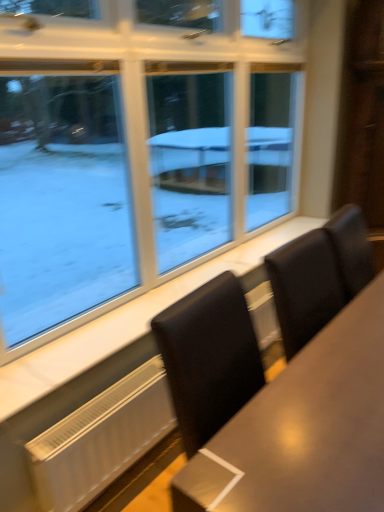
The width and height of the screenshot is (384, 512). I want to click on vacant space situated above white marble window sill at lower center (from a real-world perspective), so click(206, 271).